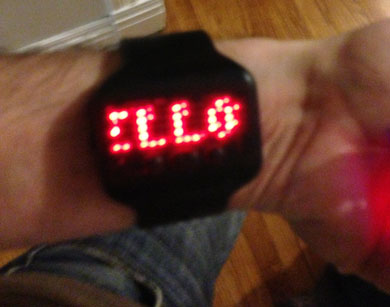
Identify the location of floor board. This screenshot has height=307, width=390. (125, 27), (93, 37).